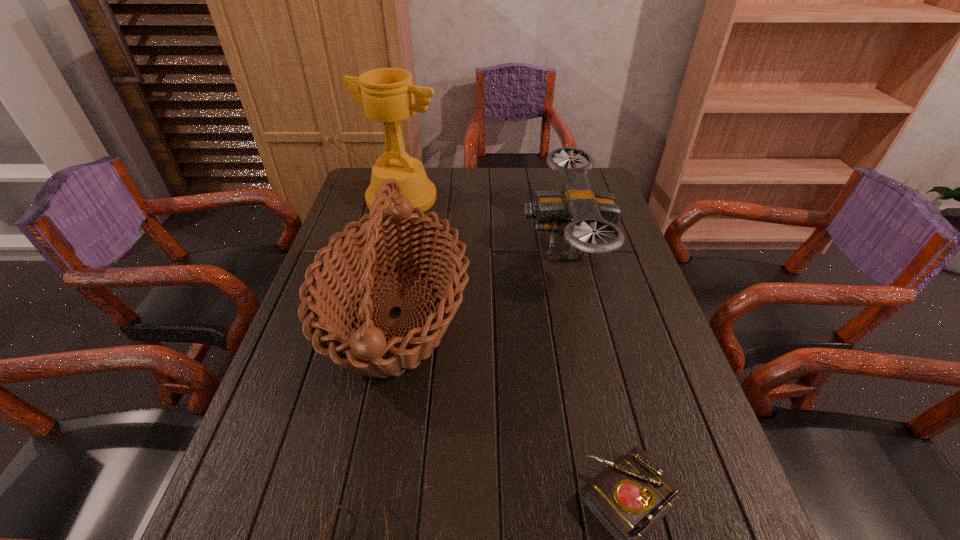
This screenshot has width=960, height=540. Identify the location of the tallest object. (387, 94).

Locate an element on the screen. This screenshot has width=960, height=540. basket is located at coordinates (400, 239).

At what (x,y) coordinates should I click in order to perform the action: click on drone. Please return your answer as a coordinate pair (x, y). Looking at the image, I should click on (582, 215).

Locate an element on the screen. The width and height of the screenshot is (960, 540). vacant space located on the front of the award is located at coordinates (381, 284).

Identify the location of vacant position located 0.070m on the front of the basket. (372, 442).

Locate an element on the screen. This screenshot has height=540, width=960. free space located on the front-facing side of the drone is located at coordinates (392, 245).

At what (x,y) coordinates should I click in order to perform the action: click on vacant space located 0.130m on the front-facing side of the drone. Please return your answer as a coordinate pair (x, y). Looking at the image, I should click on (480, 245).

Where is `vacant space located on the front-facing side of the drone`? vacant space located on the front-facing side of the drone is located at coordinates (492, 245).

This screenshot has width=960, height=540. Identify the location of award that is positioned at the far edge. (387, 94).

You are a GUI agent. You are given a task and a screenshot of the screen. Output one action in this format:
    pyautogui.click(x=<x>, y=<y>)
    Task: Click on the drone present at the far edge
    The image size is (960, 540).
    Given the screenshot: What is the action you would take?
    pyautogui.click(x=582, y=215)